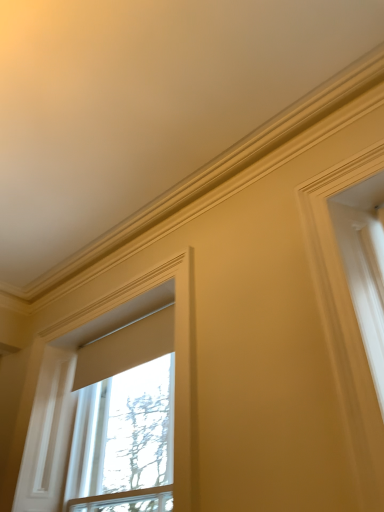
Question: Relative to matte white shade at upper left, which is the first window from left to right, is matte beige window at center, which ranks as the 2th window in left-to-right order, in front or behind?

Choices:
 (A) front
 (B) behind

Answer: (B)

Question: Would you say matte beige window at center, which ranks as the 2th window in left-to-right order, is to the left or to the right of matte white shade at upper left, which is the first window from left to right, in the picture?

Choices:
 (A) left
 (B) right

Answer: (B)

Question: Choose the correct answer: Is matte beige window at center, which ranks as the 2th window in left-to-right order, inside matte white shade at upper left, which is the first window from left to right, or outside it?

Choices:
 (A) inside
 (B) outside

Answer: (B)

Question: From a real-world perspective, is matte white shade at upper left, which is the first window from left to right, physically located above or below matte beige window at center, which ranks as the 1th window in right-to-left order?

Choices:
 (A) below
 (B) above

Answer: (B)

Question: From the image's perspective, is matte white shade at upper left, which is the first window from left to right, located above or below matte beige window at center, which ranks as the 2th window in left-to-right order?

Choices:
 (A) above
 (B) below

Answer: (A)

Question: Looking at the image, does matte white shade at upper left, which is the first window from left to right, seem bigger or smaller compared to matte beige window at center, which ranks as the 1th window in right-to-left order?

Choices:
 (A) small
 (B) big

Answer: (A)

Question: Is matte white shade at upper left, which is counted as the 2th window, starting from the right, situated inside matte beige window at center, which ranks as the 2th window in left-to-right order, or outside?

Choices:
 (A) outside
 (B) inside

Answer: (A)